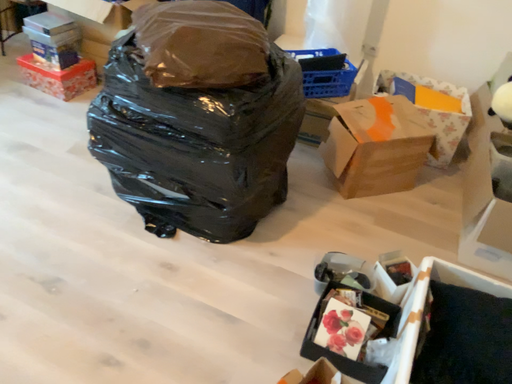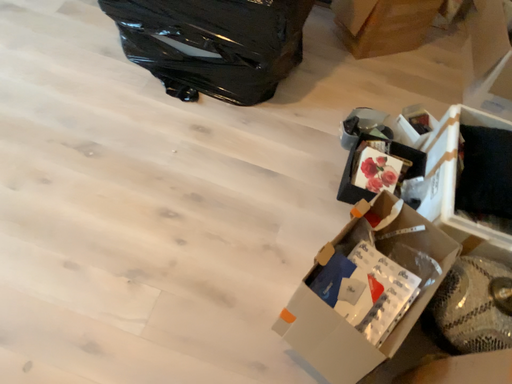
Question: Which way did the camera rotate in the video?

Choices:
 (A) rotated right
 (B) rotated left

Answer: (A)